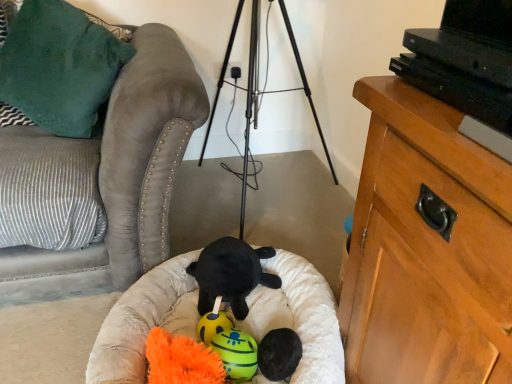
What is the approximate width of yellow rubber ball at center, the second toy when ordered from front to back?

The width of yellow rubber ball at center, the second toy when ordered from front to back, is 11.17 centimeters.

Locate an element on the screen. The image size is (512, 384). yellow rubber ball at center, which appears as the 4th toy when viewed from the front is located at coordinates (213, 325).

What do you see at coordinates (144, 321) in the screenshot? The image size is (512, 384). I see `white plush dog bed at center` at bounding box center [144, 321].

This screenshot has width=512, height=384. I want to click on wooden cabinet at right, so click(426, 248).

Where is `black plush toy at center, marked as the second toy in a back-to-front arrangement`? This screenshot has height=384, width=512. black plush toy at center, marked as the second toy in a back-to-front arrangement is located at coordinates [231, 274].

Is velvety green pillow at upper left thinner than yellow rubber ball at center, positioned as the third toy in back-to-front order?

Incorrect, the width of velvety green pillow at upper left is not less than that of yellow rubber ball at center, positioned as the third toy in back-to-front order.

Is velvety green pillow at upper left bigger than yellow rubber ball at center, the second toy when ordered from front to back?

Indeed, velvety green pillow at upper left has a larger size compared to yellow rubber ball at center, the second toy when ordered from front to back.

Is velvety green pillow at upper left not near yellow rubber ball at center, the second toy when ordered from front to back?

Absolutely, velvety green pillow at upper left is distant from yellow rubber ball at center, the second toy when ordered from front to back.

From a real-world perspective, between white plush dog bed at center and velvety green pillow at upper left, who is vertically higher?

In real-world perspective, velvety green pillow at upper left is above.

Does white plush dog bed at center have a lesser height compared to velvety green pillow at upper left?

Correct, white plush dog bed at center is not as tall as velvety green pillow at upper left.

From the image's perspective, is white plush dog bed at center on velvety green pillow at upper left?

Incorrect, from the image's perspective, white plush dog bed at center is lower than velvety green pillow at upper left.

Between white plush dog bed at center and velvety green pillow at upper left, which one is positioned behind?

velvety green pillow at upper left is further from the camera.

Is white plush dog bed at center inside or outside of black plush toy at center, marked as the second toy in a back-to-front arrangement?

white plush dog bed at center is not inside black plush toy at center, marked as the second toy in a back-to-front arrangement, it's outside.

Which object is positioned more to the left, white plush dog bed at center or black plush toy at center, marked as the second toy in a back-to-front arrangement?

white plush dog bed at center is more to the left.

Is white plush dog bed at center not close to black plush toy at center, marked as the second toy in a back-to-front arrangement?

They are positioned close to each other.

From a real-world perspective, count 3rd toys upward from the white plush dog bed at center and point to it. Please provide its 2D coordinates.

[(231, 274)]

Is there a large distance between wooden cabinet at right and velvety green pillow at upper left?

Yes.

Is wooden cabinet at right situated inside velvety green pillow at upper left or outside?

wooden cabinet at right is not inside velvety green pillow at upper left, it's outside.

Does wooden cabinet at right appear on the left side of velvety green pillow at upper left?

In fact, wooden cabinet at right is to the right of velvety green pillow at upper left.

Which is behind, point (213, 326) or point (188, 312)?

The point (188, 312) is behind.

Is yellow rubber ball at center, placed as the 1th toy when sorted from back to front, situated inside white plush dog bed at center or outside?

yellow rubber ball at center, placed as the 1th toy when sorted from back to front, exists entirely within white plush dog bed at center.

From the image's perspective, is yellow rubber ball at center, placed as the 1th toy when sorted from back to front, on white plush dog bed at center?

No, from the image's perspective, yellow rubber ball at center, placed as the 1th toy when sorted from back to front, is not over white plush dog bed at center.

Is yellow rubber ball at center, which appears as the 4th toy when viewed from the front, positioned with its back to white plush dog bed at center?

Yes, yellow rubber ball at center, which appears as the 4th toy when viewed from the front, is facing away from white plush dog bed at center.

From a real-world perspective, which toy is the 2nd one underneath the black plush toy at center, marked as the second toy in a back-to-front arrangement? Please provide its 2D coordinates.

[(236, 354)]

From the image's perspective, which one is positioned lower, black plush toy at center, marked as the second toy in a back-to-front arrangement, or yellow rubber ball at center, the second toy when ordered from front to back?

From the image's view, yellow rubber ball at center, the second toy when ordered from front to back, is below.

Considering the sizes of objects black plush toy at center, placed as the 3th toy when sorted from front to back, and yellow rubber ball at center, positioned as the third toy in back-to-front order, in the image provided, who is bigger, black plush toy at center, placed as the 3th toy when sorted from front to back, or yellow rubber ball at center, positioned as the third toy in back-to-front order,?

Bigger between the two is black plush toy at center, placed as the 3th toy when sorted from front to back.

From a real-world perspective, which object rests below the other?

yellow rubber ball at center, the second toy when ordered from front to back.

In the image, is white plush dog bed at center on the left side or the right side of soft plush ball at center, the first toy from the front?

From the image, it's evident that white plush dog bed at center is to the left of soft plush ball at center, the first toy from the front.

Consider the image. Which of these two, white plush dog bed at center or soft plush ball at center, acting as the 4th toy starting from the back, is smaller?

soft plush ball at center, acting as the 4th toy starting from the back.

Would you consider white plush dog bed at center to be distant from soft plush ball at center, acting as the 4th toy starting from the back?

No.

From a real-world perspective, is white plush dog bed at center under soft plush ball at center, acting as the 4th toy starting from the back?

Yes, from a real-world perspective, white plush dog bed at center is beneath soft plush ball at center, acting as the 4th toy starting from the back.

Locate an element on the screen. pillow behind the yellow rubber ball at center, positioned as the third toy in back-to-front order is located at coordinates (59, 66).

Find the location of a particular element. The height and width of the screenshot is (384, 512). dog bed that is on the right side of velvety green pillow at upper left is located at coordinates (144, 321).

From the image, which object appears to be farther from soft plush ball at center, acting as the 4th toy starting from the back, yellow rubber ball at center, placed as the 1th toy when sorted from back to front, or white plush dog bed at center?

white plush dog bed at center lies further to soft plush ball at center, acting as the 4th toy starting from the back, than the other object.

When comparing their distances from yellow rubber ball at center, the second toy when ordered from front to back, does velvety green pillow at upper left or wooden cabinet at right seem further?

Among the two, velvety green pillow at upper left is located further to yellow rubber ball at center, the second toy when ordered from front to back.

From the image, which object appears to be nearer to black plush toy at center, placed as the 3th toy when sorted from front to back, velvety green pillow at upper left or suede couch at left?

Based on the image, suede couch at left appears to be nearer to black plush toy at center, placed as the 3th toy when sorted from front to back.

Estimate the real-world distances between objects in this image. Which object is further from yellow rubber ball at center, which appears as the 4th toy when viewed from the front, velvety green pillow at upper left or black plush toy at center, placed as the 3th toy when sorted from front to back?

Based on the image, velvety green pillow at upper left appears to be further to yellow rubber ball at center, which appears as the 4th toy when viewed from the front.

From the picture: Estimate the real-world distances between objects in this image. Which object is closer to suede couch at left, soft plush ball at center, the first toy from the front, or black plush toy at center, marked as the second toy in a back-to-front arrangement?

black plush toy at center, marked as the second toy in a back-to-front arrangement, is positioned closer to the anchor suede couch at left.

Which object lies further to the anchor point yellow rubber ball at center, placed as the 1th toy when sorted from back to front, wooden cabinet at right or soft plush ball at center, the first toy from the front?

wooden cabinet at right is positioned further to the anchor yellow rubber ball at center, placed as the 1th toy when sorted from back to front.

Based on their spatial positions, is velvety green pillow at upper left or black plush toy at center, marked as the second toy in a back-to-front arrangement, further from suede couch at left?

black plush toy at center, marked as the second toy in a back-to-front arrangement, is positioned further to the anchor suede couch at left.

From the image, which object appears to be nearer to suede couch at left, soft plush ball at center, acting as the 4th toy starting from the back, or velvety green pillow at upper left?

velvety green pillow at upper left is closer to suede couch at left.

Identify the location of dog bed between velvety green pillow at upper left and yellow rubber ball at center, the second toy when ordered from front to back, in the vertical direction. The image size is (512, 384). (144, 321).

Locate an element on the screen. This screenshot has height=384, width=512. pillow between suede couch at left and black plush toy at center, marked as the second toy in a back-to-front arrangement, from left to right is located at coordinates (59, 66).

Image resolution: width=512 pixels, height=384 pixels. What are the coordinates of `toy between suede couch at left and black plush toy at center, placed as the 3th toy when sorted from front to back, from left to right` in the screenshot? It's located at (213, 325).

Image resolution: width=512 pixels, height=384 pixels. I want to click on pillow between suede couch at left and soft plush ball at center, acting as the 4th toy starting from the back, in the horizontal direction, so click(59, 66).